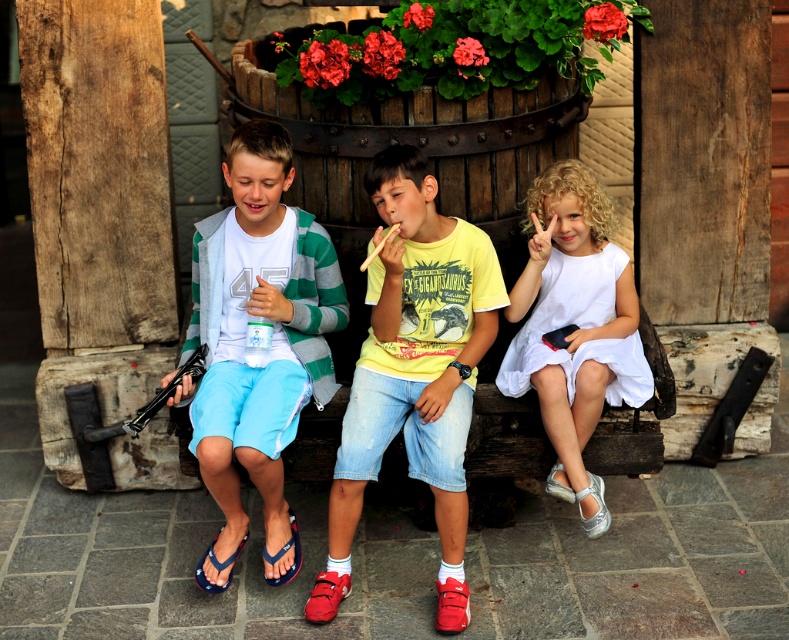
The width and height of the screenshot is (789, 640). In order to click on yellow cotton shirt at center in this screenshot , I will do `click(417, 362)`.

Is yellow cotton shirt at center shorter than white satin dress at right?

Incorrect, yellow cotton shirt at center's height does not fall short of white satin dress at right's.

Where is `yellow cotton shirt at center`? This screenshot has height=640, width=789. yellow cotton shirt at center is located at coordinates (417, 362).

Does white satin dress at right lie behind red suede sandal at lower center?

No.

Does white satin dress at right appear under red suede sandal at lower center?

Actually, white satin dress at right is above red suede sandal at lower center.

Does point (610, 244) lie in front of point (324, 577)?

That is False.

Where is `white satin dress at right`? white satin dress at right is located at coordinates (x=574, y=326).

How far apart are white satin dress at right and blue fabric sandal at lower center?

white satin dress at right and blue fabric sandal at lower center are 7.39 feet apart.

Is white satin dress at right bigger than blue fabric sandal at lower center?

Yes, white satin dress at right is bigger than blue fabric sandal at lower center.

Which is behind, point (569, 186) or point (283, 545)?

Point (283, 545)

Where is `white satin dress at right`? This screenshot has width=789, height=640. white satin dress at right is located at coordinates (574, 326).